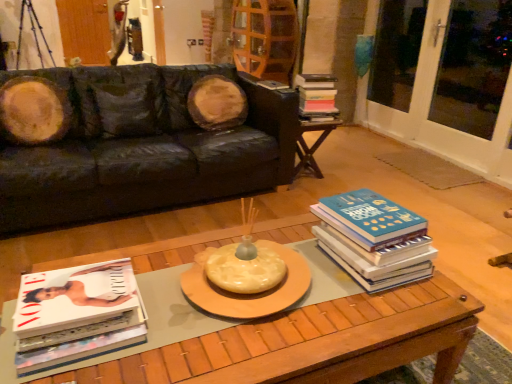
This screenshot has width=512, height=384. In order to click on free area behind white glossy magazine at lower left, the first book positioned from the bottom in this screenshot , I will do `click(158, 265)`.